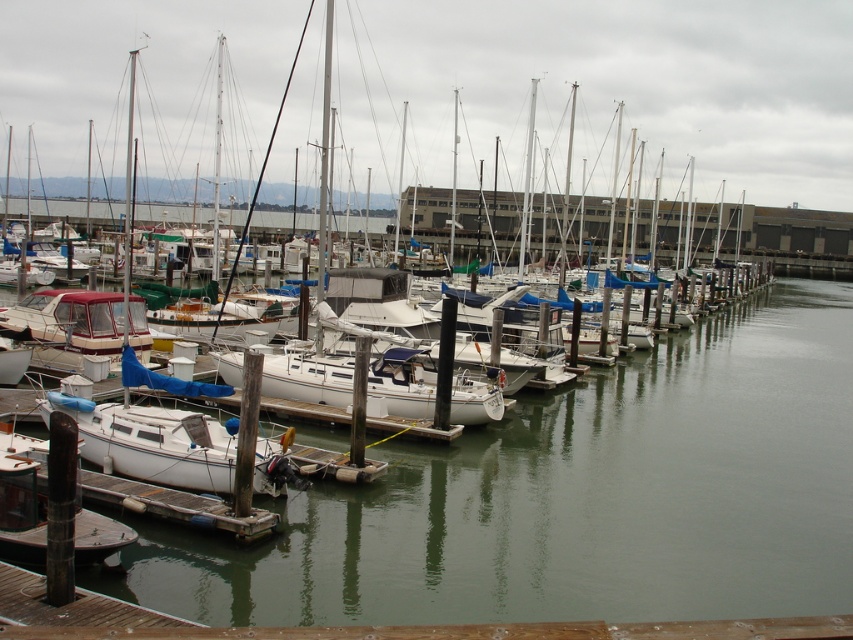
Between clear water at center and white matte sailboat at lower left, which one is positioned lower?

clear water at center

Can you confirm if clear water at center is bigger than white matte sailboat at lower left?

Incorrect, clear water at center is not larger than white matte sailboat at lower left.

Is point (614, 388) closer to camera compared to point (144, 99)?

Yes, it is.

Locate an element on the screen. Image resolution: width=853 pixels, height=640 pixels. clear water at center is located at coordinates coord(573,499).